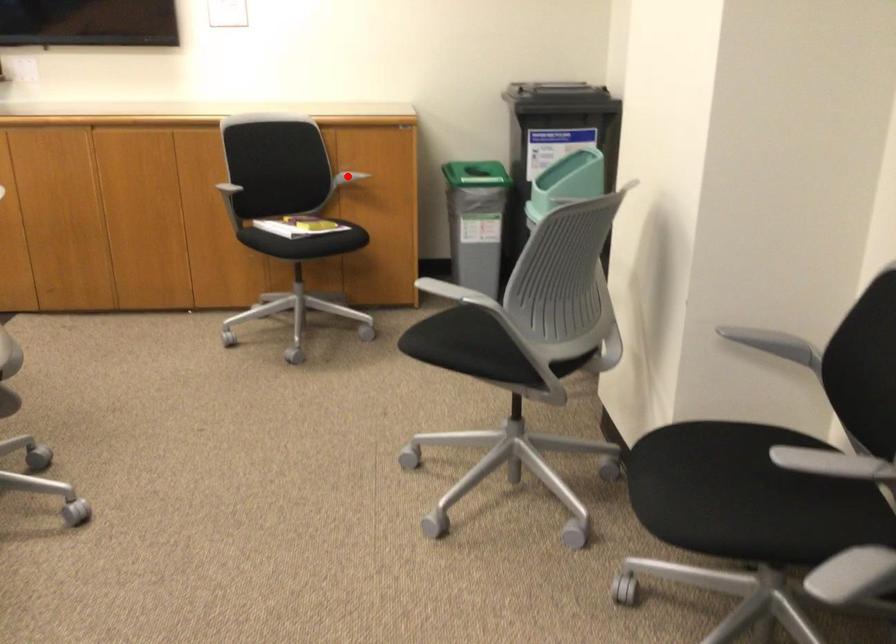
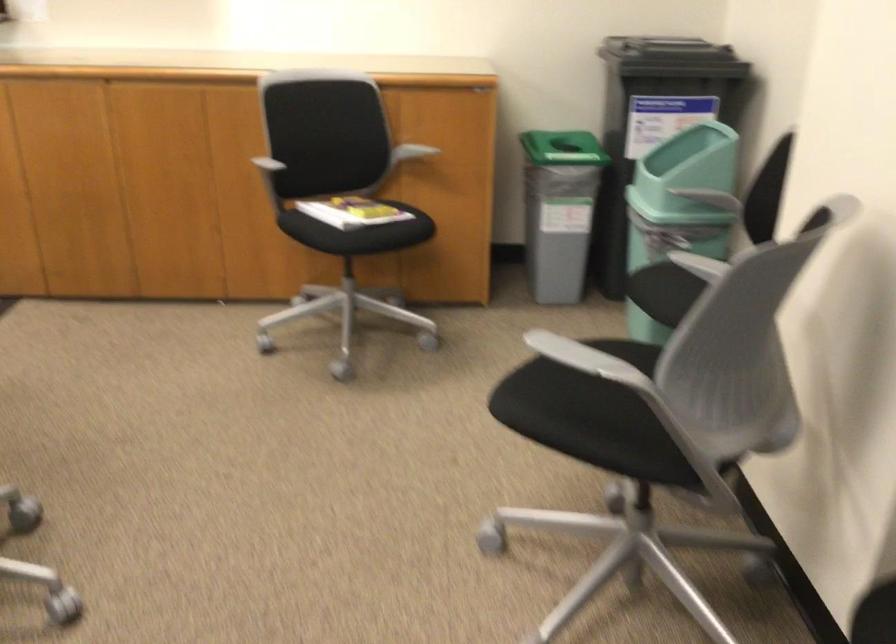
Find the pixel in the second image that matches the highlighted location in the first image.

(409, 152)